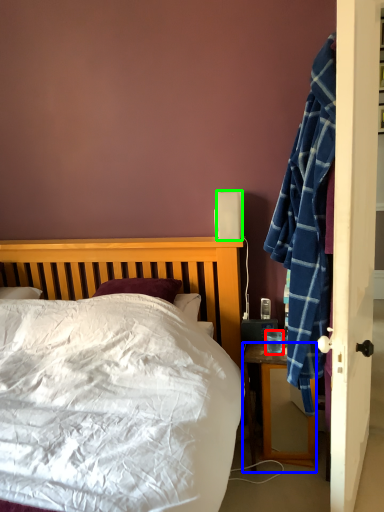
Question: Which is farther away from coffee cup (highlighted by a red box)? desk (highlighted by a blue box) or loudspeaker (highlighted by a green box)?

Choices:
 (A) desk
 (B) loudspeaker

Answer: (B)